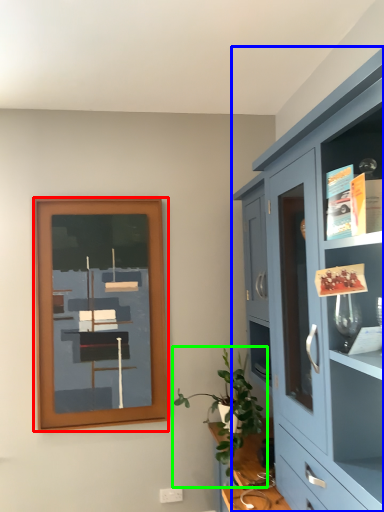
Question: Based on their relative distances, which object is farther from picture frame (highlighted by a red box)? Choose from cabinetry (highlighted by a blue box) and houseplant (highlighted by a green box).

Choices:
 (A) cabinetry
 (B) houseplant

Answer: (A)